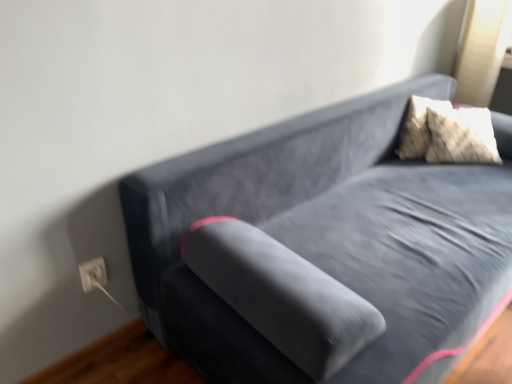
Question: Can you confirm if brown wood flooring at lower left is wider than white plastic electric outlet at lower left?

Choices:
 (A) yes
 (B) no

Answer: (A)

Question: Does brown wood flooring at lower left lie in front of white plastic electric outlet at lower left?

Choices:
 (A) no
 (B) yes

Answer: (B)

Question: Can you confirm if brown wood flooring at lower left is bigger than white plastic electric outlet at lower left?

Choices:
 (A) no
 (B) yes

Answer: (B)

Question: Can you confirm if brown wood flooring at lower left is positioned to the left of white plastic electric outlet at lower left?

Choices:
 (A) no
 (B) yes

Answer: (B)

Question: Does brown wood flooring at lower left contain white plastic electric outlet at lower left?

Choices:
 (A) yes
 (B) no

Answer: (B)

Question: Is brown wood flooring at lower left beside white plastic electric outlet at lower left?

Choices:
 (A) yes
 (B) no

Answer: (B)

Question: From a real-world perspective, is white plastic electric outlet at lower left under brown wood flooring at lower left?

Choices:
 (A) yes
 (B) no

Answer: (B)

Question: Is white plastic electric outlet at lower left positioned in front of brown wood flooring at lower left?

Choices:
 (A) no
 (B) yes

Answer: (A)

Question: Is white plastic electric outlet at lower left not near brown wood flooring at lower left?

Choices:
 (A) yes
 (B) no

Answer: (B)

Question: Is the position of white plastic electric outlet at lower left more distant than that of brown wood flooring at lower left?

Choices:
 (A) yes
 (B) no

Answer: (A)

Question: Is white plastic electric outlet at lower left outside brown wood flooring at lower left?

Choices:
 (A) no
 (B) yes

Answer: (B)

Question: Can you confirm if white plastic electric outlet at lower left is shorter than brown wood flooring at lower left?

Choices:
 (A) yes
 (B) no

Answer: (B)

Question: In the image, is white plastic electric outlet at lower left on the left side or the right side of brown wood flooring at lower left?

Choices:
 (A) right
 (B) left

Answer: (A)